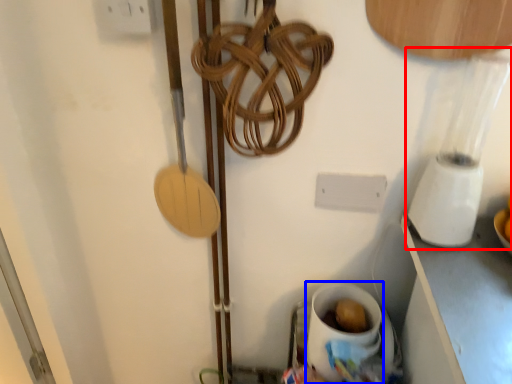
Question: Among these objects, which one is nearest to the camera, blender (highlighted by a red box) or coffee cup (highlighted by a blue box)?

Choices:
 (A) blender
 (B) coffee cup

Answer: (A)